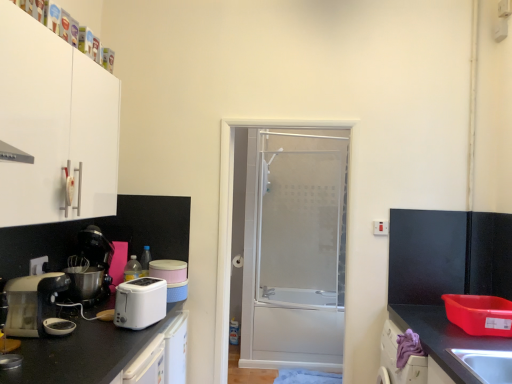
Identify the location of vacant area that lies in front of white plastic toaster at lower left. (105, 335).